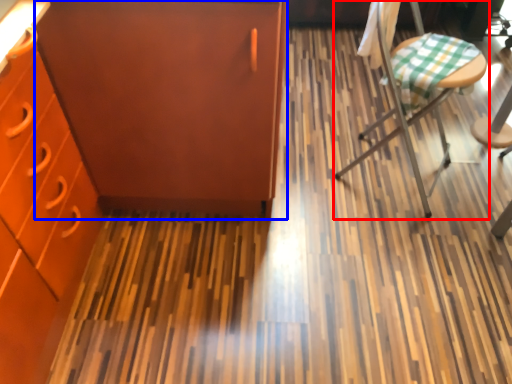
Question: Which object is further to the camera taking this photo, chair (highlighted by a red box) or file cabinet (highlighted by a blue box)?

Choices:
 (A) chair
 (B) file cabinet

Answer: (A)